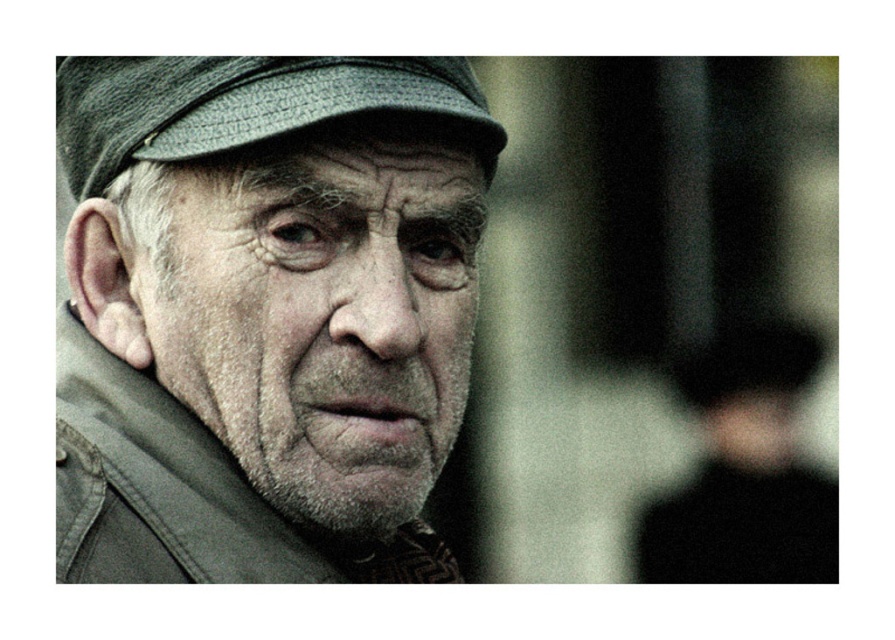
Question: Is matte gray cap at center to the left of black matte hat at right from the viewer's perspective?

Choices:
 (A) yes
 (B) no

Answer: (A)

Question: Can you confirm if matte gray cap at center is wider than textured gray beret at upper left?

Choices:
 (A) yes
 (B) no

Answer: (B)

Question: Which point is farther from the camera taking this photo?

Choices:
 (A) (193, 72)
 (B) (342, 509)
 (C) (712, 387)

Answer: (C)

Question: Does matte gray cap at center come in front of textured gray beret at upper left?

Choices:
 (A) no
 (B) yes

Answer: (A)

Question: Which point is closer to the camera taking this photo?

Choices:
 (A) (716, 400)
 (B) (205, 112)
 (C) (446, 250)

Answer: (B)

Question: Which of these objects is positioned closest to the black matte hat at right?

Choices:
 (A) textured gray beret at upper left
 (B) matte gray cap at center

Answer: (A)